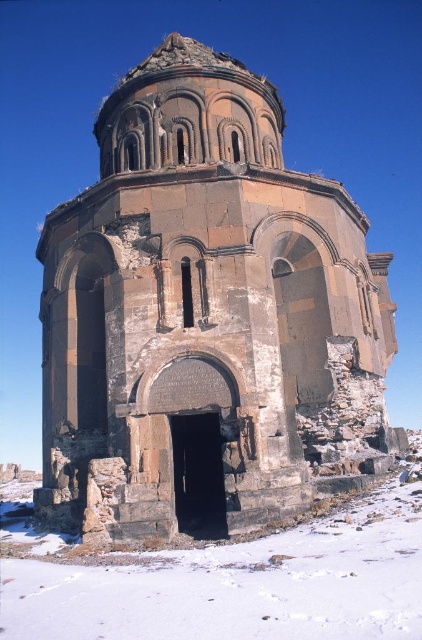
Question: Observing the image, what is the correct spatial positioning of stone church at center in reference to white powdery snow at lower center?

Choices:
 (A) below
 (B) above

Answer: (B)

Question: Is stone church at center positioned behind white powdery snow at lower center?

Choices:
 (A) no
 (B) yes

Answer: (B)

Question: Which point is closer to the camera taking this photo?

Choices:
 (A) (222, 436)
 (B) (332, 620)

Answer: (B)

Question: Which of the following is the closest to the observer?

Choices:
 (A) white powdery snow at lower center
 (B) stone church at center

Answer: (A)

Question: Which point appears closest to the camera in this image?

Choices:
 (A) (278, 616)
 (B) (48, 394)

Answer: (A)

Question: Does stone church at center appear under white powdery snow at lower center?

Choices:
 (A) no
 (B) yes

Answer: (A)